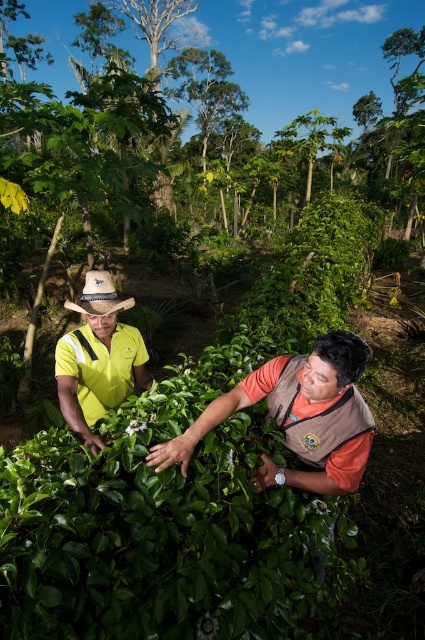
Question: Which point appears closest to the camera in this image?

Choices:
 (A) (102, 314)
 (B) (388, 97)

Answer: (A)

Question: Can you confirm if brown vest at center is positioned to the left of yellow fabric shirt at left?

Choices:
 (A) yes
 (B) no

Answer: (B)

Question: Can you confirm if green leafy tree at upper center is bigger than yellow fabric shirt at left?

Choices:
 (A) yes
 (B) no

Answer: (A)

Question: Which of the following is the closest to the observer?

Choices:
 (A) (274, 131)
 (B) (82, 435)
 (C) (294, 364)

Answer: (C)

Question: Is brown vest at center bigger than yellow fabric shirt at left?

Choices:
 (A) no
 (B) yes

Answer: (A)

Question: Which point is closer to the camera?

Choices:
 (A) yellow fabric shirt at left
 (B) brown vest at center

Answer: (B)